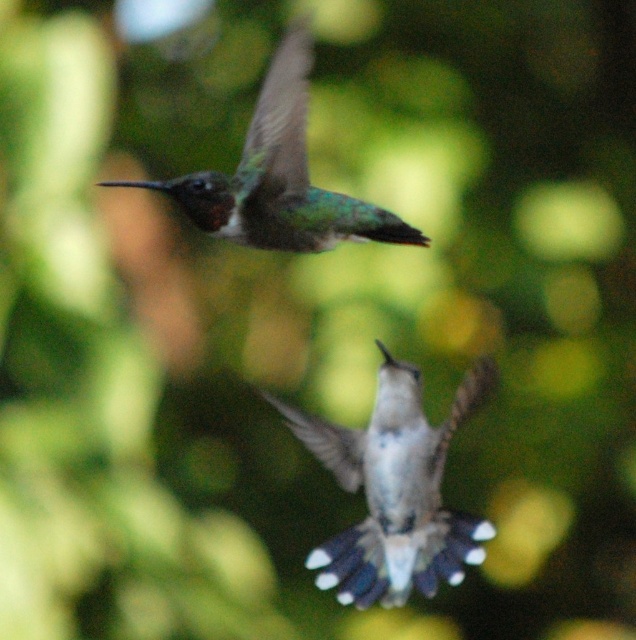
Between white glossy hummingbird at center and green iridescent hummingbird at upper center, which one is positioned higher?

green iridescent hummingbird at upper center is above.

This screenshot has height=640, width=636. What do you see at coordinates (394, 490) in the screenshot? I see `white glossy hummingbird at center` at bounding box center [394, 490].

Does point (396, 548) come in front of point (314, 241)?

No, it is not.

This screenshot has height=640, width=636. I want to click on white glossy hummingbird at center, so click(x=394, y=490).